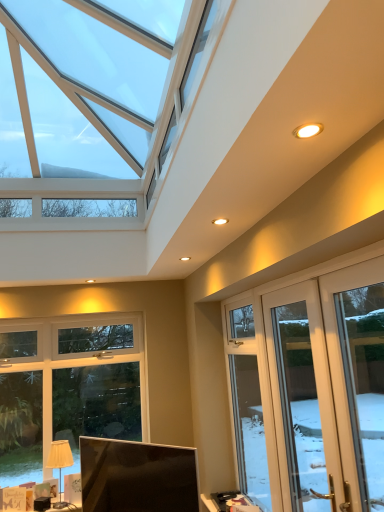
Question: Does matte white screen door at lower right, positioned as the first screen door in front-to-back order, appear on the left side of beige fabric lampshade at lower left?

Choices:
 (A) yes
 (B) no

Answer: (B)

Question: Is matte white screen door at lower right, positioned as the first screen door in front-to-back order, oriented away from beige fabric lampshade at lower left?

Choices:
 (A) yes
 (B) no

Answer: (B)

Question: Can you confirm if matte white screen door at lower right, acting as the second screen door starting from the back, is thinner than beige fabric lampshade at lower left?

Choices:
 (A) no
 (B) yes

Answer: (B)

Question: Can you confirm if matte white screen door at lower right, acting as the second screen door starting from the back, is smaller than beige fabric lampshade at lower left?

Choices:
 (A) no
 (B) yes

Answer: (A)

Question: Considering the relative positions of matte white screen door at lower right, positioned as the first screen door in front-to-back order, and beige fabric lampshade at lower left in the image provided, is matte white screen door at lower right, positioned as the first screen door in front-to-back order, to the right of beige fabric lampshade at lower left from the viewer's perspective?

Choices:
 (A) no
 (B) yes

Answer: (B)

Question: From their relative heights in the image, would you say matte black monitor at lower center is taller or shorter than clear glass door at right, placed as the first window when sorted from right to left?

Choices:
 (A) tall
 (B) short

Answer: (B)

Question: Does point (87, 463) appear closer or farther from the camera than point (354, 338)?

Choices:
 (A) closer
 (B) farther

Answer: (A)

Question: Which is correct: matte black monitor at lower center is inside clear glass door at right, acting as the 2th window starting from the left, or outside of it?

Choices:
 (A) outside
 (B) inside

Answer: (A)

Question: From a real-world perspective, is matte black monitor at lower center above or below clear glass door at right, which is the second window from back to front?

Choices:
 (A) below
 (B) above

Answer: (A)

Question: In terms of size, does clear glass door at right, which is the second window from back to front, appear bigger or smaller than matte black monitor at lower center?

Choices:
 (A) small
 (B) big

Answer: (A)

Question: Considering the relative positions of clear glass door at right, which is the second window from back to front, and matte black monitor at lower center in the image provided, is clear glass door at right, which is the second window from back to front, to the left or to the right of matte black monitor at lower center?

Choices:
 (A) right
 (B) left

Answer: (A)

Question: Is point (354, 445) positioned closer to the camera than point (163, 501)?

Choices:
 (A) closer
 (B) farther

Answer: (A)

Question: Looking at their shapes, would you say clear glass door at right, acting as the 1th window starting from the front, is wider or thinner than matte black monitor at lower center?

Choices:
 (A) thin
 (B) wide

Answer: (A)

Question: Which is correct: clear glass door at center, the 2th window viewed from the right, is inside matte white screen door at lower right, positioned as the first screen door in front-to-back order, or outside of it?

Choices:
 (A) outside
 (B) inside

Answer: (A)

Question: In the image, is clear glass door at center, positioned as the second window in front-to-back order, on the left side or the right side of matte white screen door at lower right, acting as the second screen door starting from the back?

Choices:
 (A) left
 (B) right

Answer: (A)